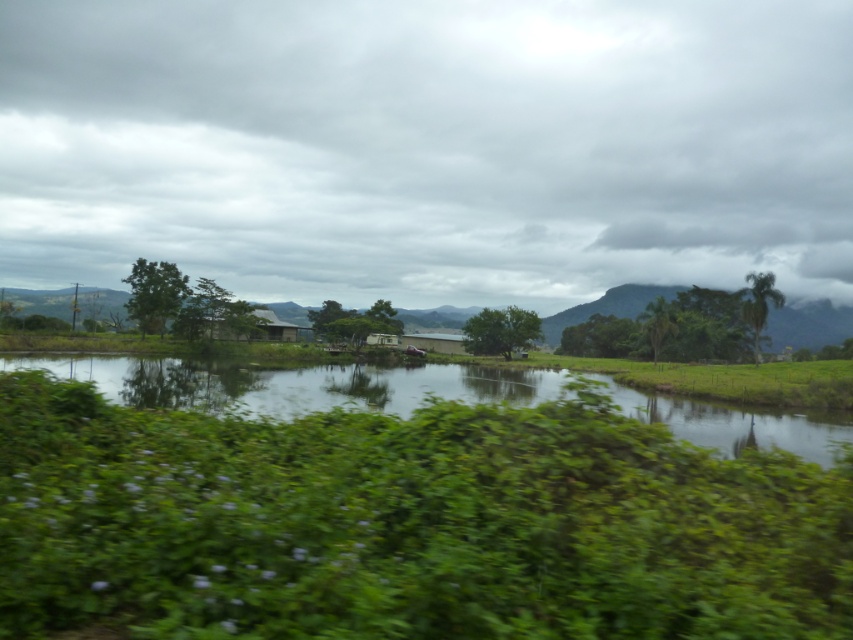
You are standing in the rural landscape scene. You see two points marked in the image. The first point is at coordinate point [762,572] and the second point is at coordinate point [438,388]. Which point is closer to you?

Point [762,572] is closer to the camera than point [438,388], so the first point is closer to you.